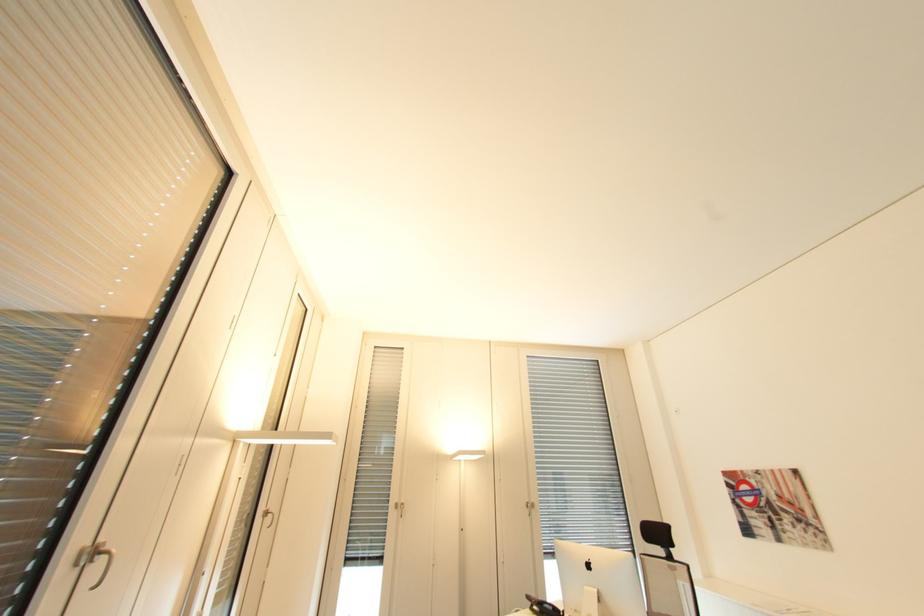
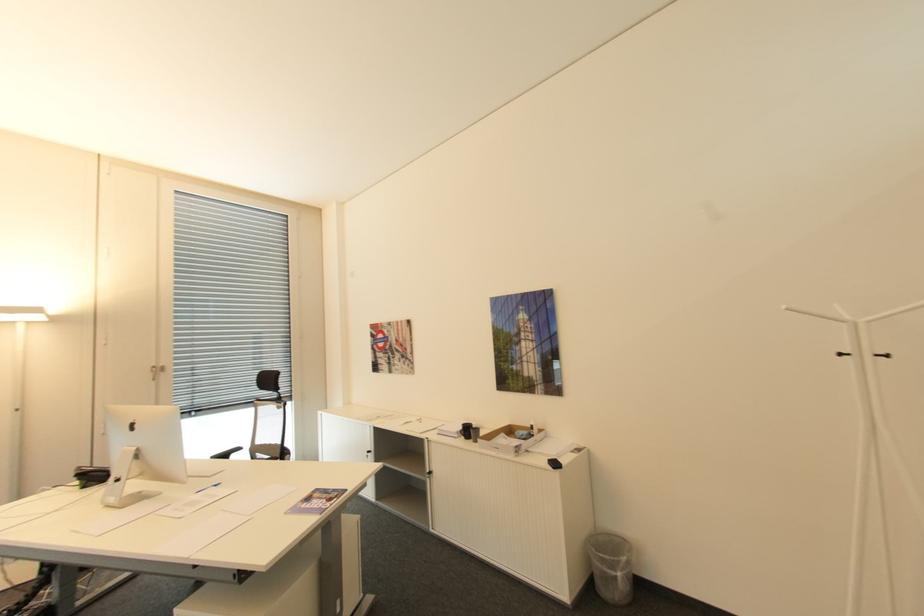
In the second image, find the point that corresponds to point 531,501 in the first image.

(159, 367)